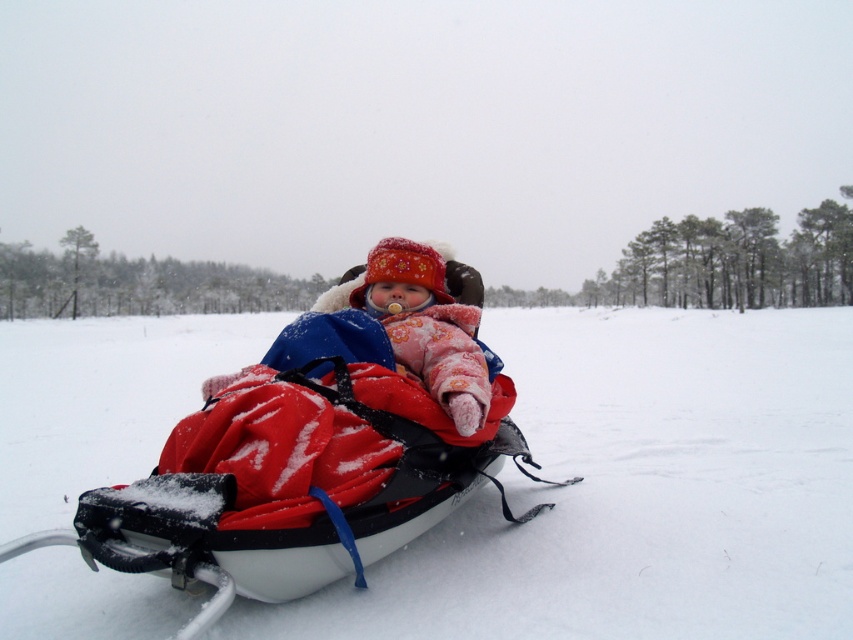
Based on the photo, A drone is flying above the snowy landscape and needs to drop a package precisely at the location of the red fabric snowmobile at center. According to the coordinates provided, where should the drone aim? Please state the coordinates in the format of a point.

The drone should aim at point (102, 401) because the 2D location of the red fabric snowmobile at center is at that point.

You are a parent trying to locate your child in a snowy area. You see the red fabric snowmobile at center and the fluffy pink snowsuit at center. Which object is closer to you?

The red fabric snowmobile at center is positioned over the fluffy pink snowsuit at center, so the red fabric snowmobile at center is closer to you.